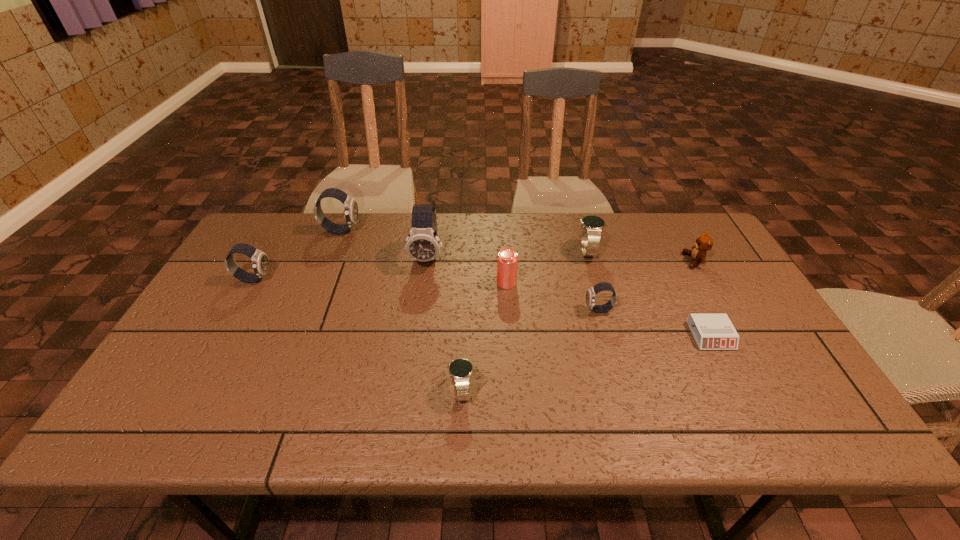
The image size is (960, 540). What are the coordinates of `object that ranks as the sixth closest to the teddy bear` in the screenshot? It's located at (460, 370).

Locate which watch is the second closest to the bigger blue watch. Please provide its 2D coordinates. Your answer should be formatted as a tuple, i.e. [(x, y)], where the tuple contains the x and y coordinates of a point satisfying the conditions above.

[(423, 244)]

At what (x,y) coordinates should I click in order to perform the action: click on watch identified as the third closest to the second nearest watch. Please return your answer as a coordinate pair (x, y). The image size is (960, 540). Looking at the image, I should click on (423, 244).

You are a GUI agent. You are given a task and a screenshot of the screen. Output one action in this format:
    pyautogui.click(x=<x>, y=<y>)
    Task: Click on the second closest dark watch to the smaller blue watch
    This screenshot has height=540, width=960.
    Given the screenshot: What is the action you would take?
    pyautogui.click(x=423, y=244)

Locate which dark watch ranks in proximity to the beer can. Please provide its 2D coordinates. Your answer should be formatted as a tuple, i.e. [(x, y)], where the tuple contains the x and y coordinates of a point satisfying the conditions above.

[(423, 244)]

Locate an element on the screen. The height and width of the screenshot is (540, 960). free space that satisfies the following two spatial constraints: 1. on the face of the second smallest dark watch; 2. on the left side of the nearest object is located at coordinates (191, 390).

Locate an element on the screen. This screenshot has width=960, height=540. vacant region that satisfies the following two spatial constraints: 1. on the face of the fifth object from right to left; 2. on the right side of the farthest watch is located at coordinates (320, 283).

This screenshot has width=960, height=540. I want to click on blank space that satisfies the following two spatial constraints: 1. on the face of the second smallest dark watch; 2. on the back side of the fifth object from right to left, so click(252, 283).

The height and width of the screenshot is (540, 960). Identify the location of vacant space that satisfies the following two spatial constraints: 1. on the back side of the right blue watch; 2. on the right side of the fifth object from left to right. (504, 251).